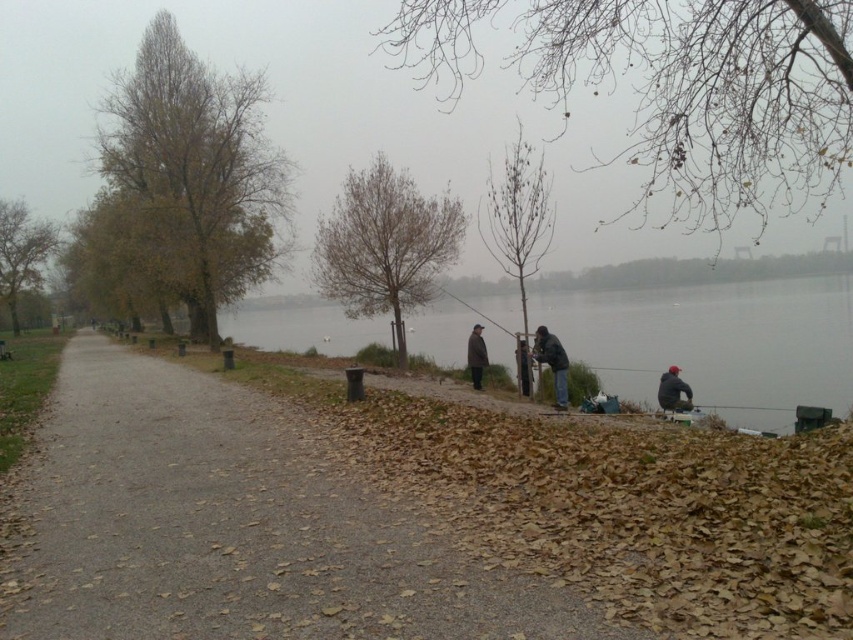
Question: Can you confirm if brown gravel path at center is positioned above dark gray jacket at center?

Choices:
 (A) no
 (B) yes

Answer: (A)

Question: Which point appears farthest from the camera in this image?

Choices:
 (A) (657, 358)
 (B) (666, 372)
 (C) (525, 348)

Answer: (A)

Question: Is brown gravel path at center closer to camera compared to dark gray jacket at center?

Choices:
 (A) no
 (B) yes

Answer: (B)

Question: From the image, what is the correct spatial relationship of brown gravel path at center in relation to brown wool coat at center?

Choices:
 (A) right
 (B) left

Answer: (B)

Question: Among these points, which one is farthest from the camera?

Choices:
 (A) (659, 401)
 (B) (224, 381)
 (C) (548, 346)

Answer: (B)

Question: Which object is positioned closest to the brown wool coat at center?

Choices:
 (A) brown gravel path at center
 (B) gray concrete lake at lower right
 (C) dark gray jacket at lower right

Answer: (C)